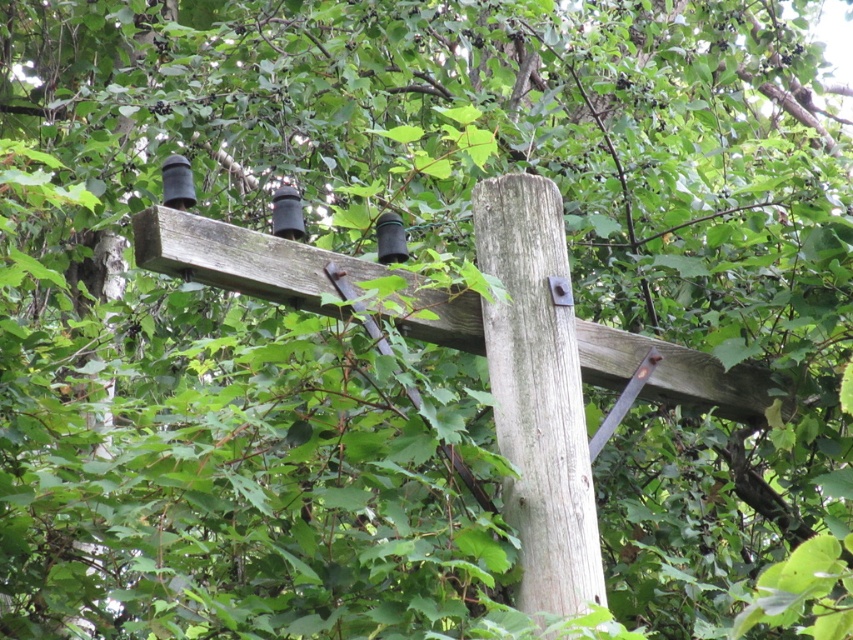
Can you confirm if gray wood telegraph pole at center is positioned above weathered wood beam at center?

No.

Does gray wood telegraph pole at center have a greater height compared to weathered wood beam at center?

Correct, gray wood telegraph pole at center is much taller as weathered wood beam at center.

Who is more forward, (550,228) or (590,376)?

Point (550,228) is more forward.

The height and width of the screenshot is (640, 853). In order to click on gray wood telegraph pole at center in this screenshot , I will do `click(538, 394)`.